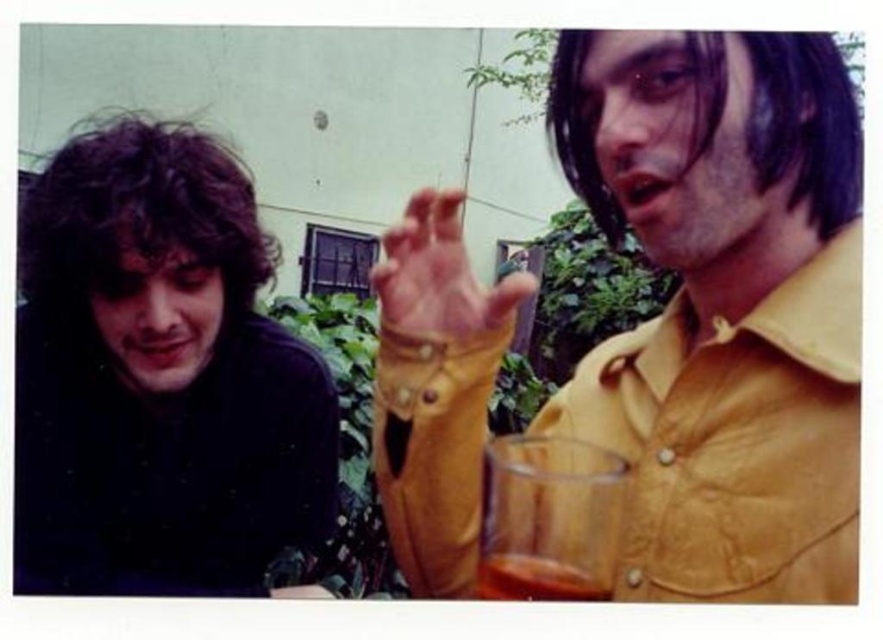
Is translucent glass at lower right smaller than leather glove at center?

Indeed, translucent glass at lower right has a smaller size compared to leather glove at center.

Is translucent glass at lower right below leather glove at center?

Correct, translucent glass at lower right is located below leather glove at center.

Is point (605, 529) more distant than point (438, 330)?

No, (605, 529) is closer to viewer.

Where is `translucent glass at lower right`? This screenshot has width=883, height=640. translucent glass at lower right is located at coordinates (549, 518).

Which is behind, point (410, 493) or point (451, 323)?

Positioned behind is point (410, 493).

Can you confirm if yellow leather shirt at upper right is shorter than leather glove at center?

In fact, yellow leather shirt at upper right may be taller than leather glove at center.

This screenshot has width=883, height=640. I want to click on yellow leather shirt at upper right, so 723,305.

Locate an element on the screen. Image resolution: width=883 pixels, height=640 pixels. yellow leather shirt at upper right is located at coordinates (723, 305).

Is point (419, 300) less distant than point (512, 554)?

No, it is behind (512, 554).

Who is lower down, leather glove at center or translucent glass beverage at lower center?

Positioned lower is translucent glass beverage at lower center.

Who is more forward, (412, 220) or (557, 561)?

Point (557, 561) is more forward.

Locate an element on the screen. leather glove at center is located at coordinates (439, 275).